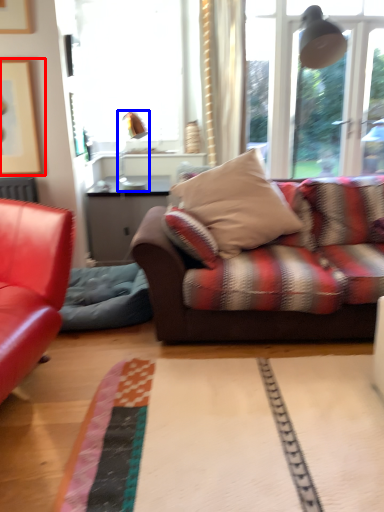
Question: Which point is closer to the camera, picture frame (highlighted by a red box) or lamp (highlighted by a blue box)?

Choices:
 (A) picture frame
 (B) lamp

Answer: (A)